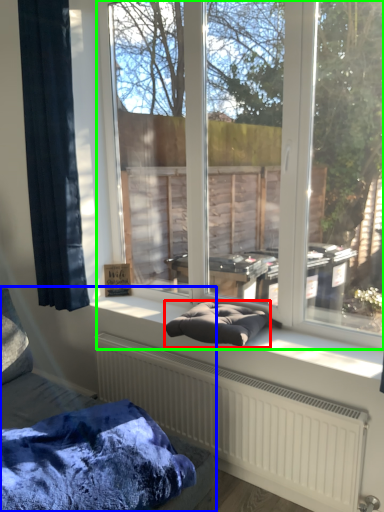
Question: Which object is the farthest from material (highlighted by a red box)? Choose among these: furniture (highlighted by a blue box) or window (highlighted by a green box).

Choices:
 (A) furniture
 (B) window

Answer: (B)